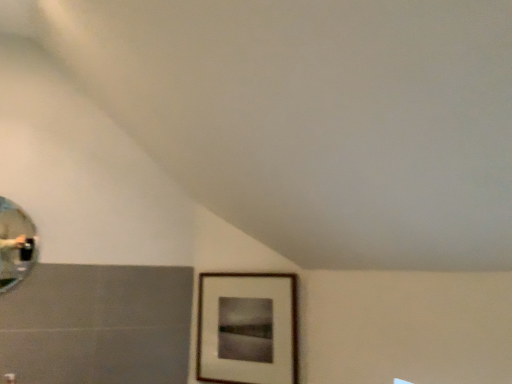
Question: Is wooden picture frame at lower right to the left or to the right of shiny silver mirror at left in the image?

Choices:
 (A) right
 (B) left

Answer: (A)

Question: From the image's perspective, is wooden picture frame at lower right positioned above or below shiny silver mirror at left?

Choices:
 (A) above
 (B) below

Answer: (B)

Question: Relative to shiny silver mirror at left, is wooden picture frame at lower right in front or behind?

Choices:
 (A) behind
 (B) front

Answer: (A)

Question: Is shiny silver mirror at left situated inside wooden picture frame at lower right or outside?

Choices:
 (A) outside
 (B) inside

Answer: (A)

Question: From a real-world perspective, is shiny silver mirror at left physically located above or below wooden picture frame at lower right?

Choices:
 (A) below
 (B) above

Answer: (B)

Question: In terms of size, does shiny silver mirror at left appear bigger or smaller than wooden picture frame at lower right?

Choices:
 (A) small
 (B) big

Answer: (A)

Question: Is shiny silver mirror at left taller or shorter than wooden picture frame at lower right?

Choices:
 (A) short
 (B) tall

Answer: (A)